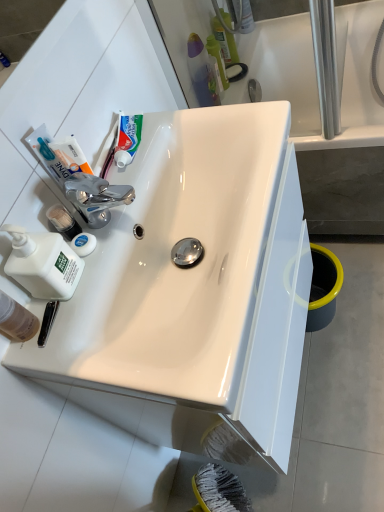
I want to click on vacant area that lies to the right of translucent plastic mouthwash at lower left, so click(x=88, y=300).